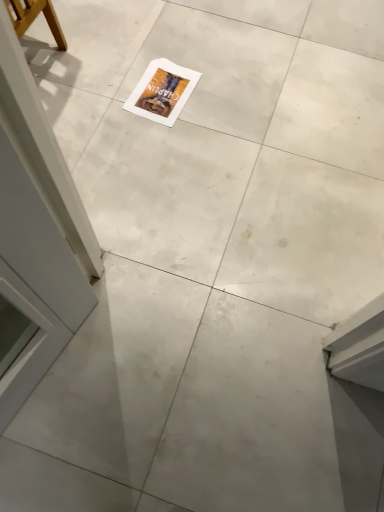
At what (x,y) coordinates should I click in order to perform the action: click on vacant location behind white paper postcard at center. Please return your answer as a coordinate pair (x, y). Looking at the image, I should click on (167, 40).